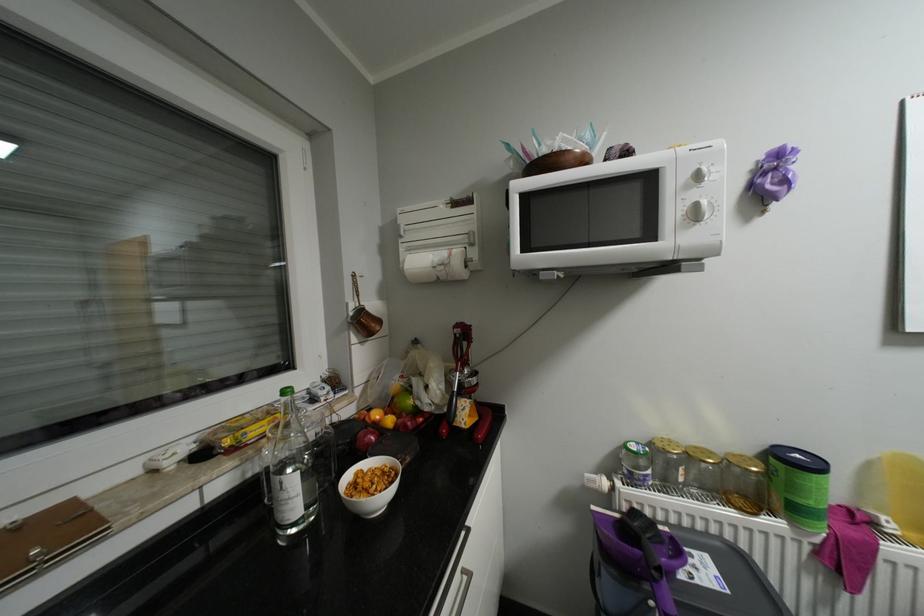
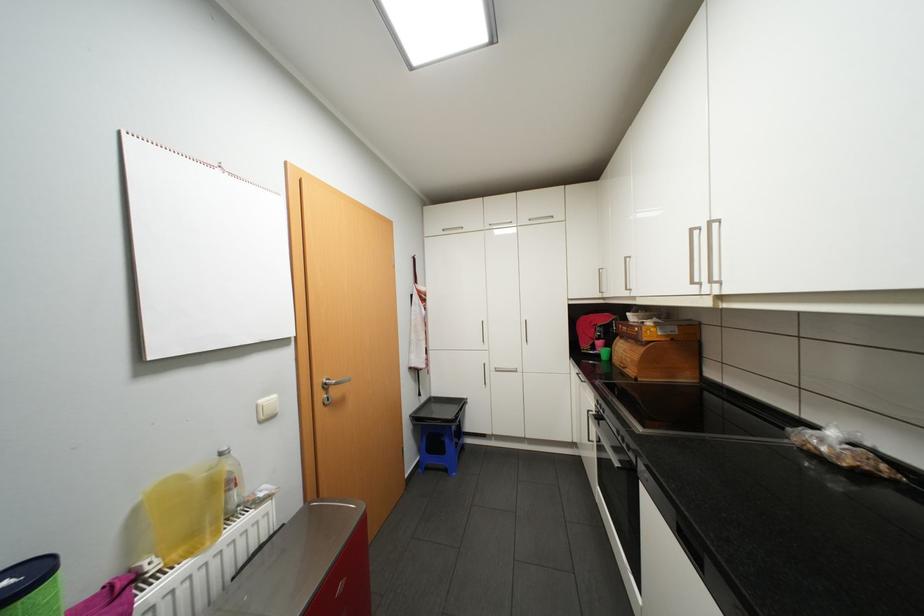
Question: The first image is from the beginning of the video and the second image is from the end. How did the camera likely rotate when shooting the video?

Choices:
 (A) Left
 (B) Right
 (C) Up
 (D) Down

Answer: (B)